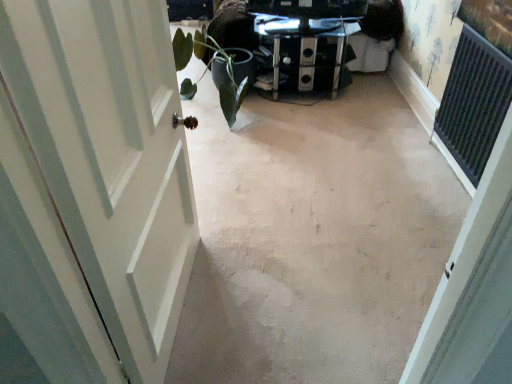
Question: Can you confirm if metallic glass table at center is thinner than green matte plant at left?

Choices:
 (A) no
 (B) yes

Answer: (B)

Question: Is metallic glass table at center far away from green matte plant at left?

Choices:
 (A) no
 (B) yes

Answer: (A)

Question: Can you confirm if metallic glass table at center is taller than green matte plant at left?

Choices:
 (A) yes
 (B) no

Answer: (B)

Question: Does metallic glass table at center turn towards green matte plant at left?

Choices:
 (A) no
 (B) yes

Answer: (A)

Question: Is metallic glass table at center surrounding green matte plant at left?

Choices:
 (A) yes
 (B) no

Answer: (B)

Question: Is metallic glass table at center bigger than green matte plant at left?

Choices:
 (A) no
 (B) yes

Answer: (A)

Question: Does metallic glass table at center appear on the right side of white painted wood door at left?

Choices:
 (A) yes
 (B) no

Answer: (A)

Question: Can you confirm if metallic glass table at center is bigger than white painted wood door at left?

Choices:
 (A) no
 (B) yes

Answer: (A)

Question: From the image's perspective, would you say metallic glass table at center is shown under white painted wood door at left?

Choices:
 (A) yes
 (B) no

Answer: (B)

Question: Is metallic glass table at center facing away from white painted wood door at left?

Choices:
 (A) no
 (B) yes

Answer: (A)

Question: Is metallic glass table at center further to the viewer compared to white painted wood door at left?

Choices:
 (A) yes
 (B) no

Answer: (A)

Question: Can we say metallic glass table at center lies outside white painted wood door at left?

Choices:
 (A) no
 (B) yes

Answer: (B)

Question: From the image's perspective, is beige carpet at center under green matte plant at left?

Choices:
 (A) yes
 (B) no

Answer: (A)